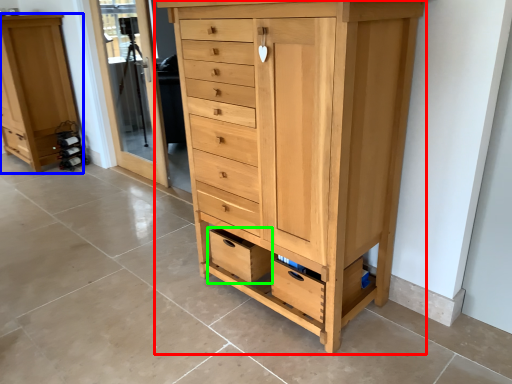
Question: Which object is positioned farthest from chest of drawers (highlighted by a red box)? Select from chest of drawers (highlighted by a blue box) and drawer (highlighted by a green box).

Choices:
 (A) chest of drawers
 (B) drawer

Answer: (A)